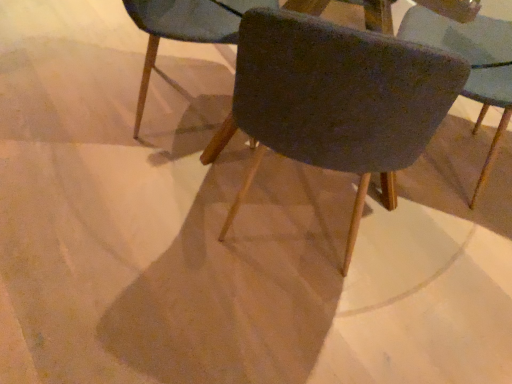
The image size is (512, 384). What do you see at coordinates (337, 99) in the screenshot?
I see `velvet dark blue chair at center, placed as the 2th chair when sorted from left to right` at bounding box center [337, 99].

Measure the distance between velvet dark blue chair at center, the 3th chair from the right, and camera.

4.02 feet.

Identify the location of velvet dark blue chair at center, the 1th chair in the left-to-right sequence. This screenshot has height=384, width=512. (185, 28).

Locate an element on the screen. The width and height of the screenshot is (512, 384). velvet dark blue chair at center, the second chair when ordered from right to left is located at coordinates (337, 99).

Choose the correct answer: Is velvet dark blue chair at center, which is the 1th chair from right to left, inside velvet dark blue chair at center, placed as the 2th chair when sorted from left to right, or outside it?

velvet dark blue chair at center, which is the 1th chair from right to left, lies outside velvet dark blue chair at center, placed as the 2th chair when sorted from left to right.

Could you measure the distance between velvet dark blue chair at center, the 3th chair viewed from the left, and velvet dark blue chair at center, the second chair when ordered from right to left?

velvet dark blue chair at center, the 3th chair viewed from the left, and velvet dark blue chair at center, the second chair when ordered from right to left, are 27.12 inches apart from each other.

Find the location of `the 1st chair behind the velvet dark blue chair at center, placed as the 2th chair when sorted from left to right`. the 1st chair behind the velvet dark blue chair at center, placed as the 2th chair when sorted from left to right is located at coordinates (472, 64).

Is the position of velvet dark blue chair at center, the 3th chair from the right, more distant than that of velvet dark blue chair at center, the 3th chair viewed from the left?

Yes, velvet dark blue chair at center, the 3th chair from the right, is further from the camera.

How different are the orientations of velvet dark blue chair at center, the 1th chair in the left-to-right sequence, and velvet dark blue chair at center, the 3th chair viewed from the left, in degrees?

161 degrees.

Would you say velvet dark blue chair at center, which is the 1th chair from right to left, is part of velvet dark blue chair at center, the 3th chair from the right,'s contents?

No, velvet dark blue chair at center, which is the 1th chair from right to left, is not inside velvet dark blue chair at center, the 3th chair from the right.

Does velvet dark blue chair at center, the 3th chair from the right, turn towards velvet dark blue chair at center, the 3th chair viewed from the left?

Yes.

Can you see velvet dark blue chair at center, which is the 1th chair from right to left, touching velvet dark blue chair at center, the 3th chair from the right?

There is a gap between velvet dark blue chair at center, which is the 1th chair from right to left, and velvet dark blue chair at center, the 3th chair from the right.

Locate an element on the screen. chair that is the 1st one above the velvet dark blue chair at center, the 3th chair from the right (from a real-world perspective) is located at coordinates click(472, 64).

In terms of size, does velvet dark blue chair at center, the 3th chair viewed from the left, appear bigger or smaller than velvet dark blue chair at center, the 3th chair from the right?

Clearly, velvet dark blue chair at center, the 3th chair viewed from the left, is larger in size than velvet dark blue chair at center, the 3th chair from the right.

Between point (490, 40) and point (268, 4), which one is positioned behind?

The point (490, 40) is behind.

Considering the sizes of objects velvet dark blue chair at center, the second chair when ordered from right to left, and velvet dark blue chair at center, which is the 1th chair from right to left, in the image provided, who is wider, velvet dark blue chair at center, the second chair when ordered from right to left, or velvet dark blue chair at center, which is the 1th chair from right to left,?

velvet dark blue chair at center, the second chair when ordered from right to left.

Measure the distance between velvet dark blue chair at center, the second chair when ordered from right to left, and velvet dark blue chair at center, which is the 1th chair from right to left.

The distance of velvet dark blue chair at center, the second chair when ordered from right to left, from velvet dark blue chair at center, which is the 1th chair from right to left, is 27.12 inches.

Which is more to the right, velvet dark blue chair at center, the second chair when ordered from right to left, or velvet dark blue chair at center, which is the 1th chair from right to left?

velvet dark blue chair at center, which is the 1th chair from right to left.

From the image's perspective, does velvet dark blue chair at center, the second chair when ordered from right to left, appear lower than velvet dark blue chair at center, which is the 1th chair from right to left?

Correct, velvet dark blue chair at center, the second chair when ordered from right to left, appears lower than velvet dark blue chair at center, which is the 1th chair from right to left, in the image.

Based on the photo, does velvet dark blue chair at center, the 3th chair from the right, touch velvet dark blue chair at center, placed as the 2th chair when sorted from left to right?

No, velvet dark blue chair at center, the 3th chair from the right, is not beside velvet dark blue chair at center, placed as the 2th chair when sorted from left to right.

Is velvet dark blue chair at center, the 1th chair in the left-to-right sequence, to the left or to the right of velvet dark blue chair at center, placed as the 2th chair when sorted from left to right, in the image?

velvet dark blue chair at center, the 1th chair in the left-to-right sequence, is positioned on velvet dark blue chair at center, placed as the 2th chair when sorted from left to right,'s left side.

Is velvet dark blue chair at center, the 1th chair in the left-to-right sequence, spatially inside velvet dark blue chair at center, the second chair when ordered from right to left, or outside of it?

The correct answer is: outside.

What's the angular difference between velvet dark blue chair at center, the 3th chair from the right, and velvet dark blue chair at center, the second chair when ordered from right to left,'s facing directions?

The angle between the facing direction of velvet dark blue chair at center, the 3th chair from the right, and the facing direction of velvet dark blue chair at center, the second chair when ordered from right to left, is 73 degrees.

From the image's perspective, does velvet dark blue chair at center, placed as the 2th chair when sorted from left to right, appear higher than velvet dark blue chair at center, the 1th chair in the left-to-right sequence?

No, from the image's perspective, velvet dark blue chair at center, placed as the 2th chair when sorted from left to right, is not on top of velvet dark blue chair at center, the 1th chair in the left-to-right sequence.

Is point (328, 85) closer or farther from the camera than point (149, 35)?

Point (328, 85) is positioned closer to the camera compared to point (149, 35).

Is velvet dark blue chair at center, placed as the 2th chair when sorted from left to right, positioned with its back to velvet dark blue chair at center, the 3th chair from the right?

velvet dark blue chair at center, placed as the 2th chair when sorted from left to right, is not turned away from velvet dark blue chair at center, the 3th chair from the right.

From a real-world perspective, who is located lower, velvet dark blue chair at center, the second chair when ordered from right to left, or velvet dark blue chair at center, the 1th chair in the left-to-right sequence?

velvet dark blue chair at center, the 1th chair in the left-to-right sequence.

Find the location of a particular element. Image resolution: width=512 pixels, height=384 pixels. chair that is above the velvet dark blue chair at center, the 3th chair viewed from the left (from a real-world perspective) is located at coordinates (337, 99).

Identify the location of the 2nd chair counting from the left side of the velvet dark blue chair at center, the 3th chair viewed from the left. The image size is (512, 384). (185, 28).

Looking at the image, which one is located further to velvet dark blue chair at center, the 3th chair viewed from the left, velvet dark blue chair at center, the 3th chair from the right, or velvet dark blue chair at center, placed as the 2th chair when sorted from left to right?

Based on the image, velvet dark blue chair at center, placed as the 2th chair when sorted from left to right, appears to be further to velvet dark blue chair at center, the 3th chair viewed from the left.

Based on their spatial positions, is velvet dark blue chair at center, the 3th chair viewed from the left, or velvet dark blue chair at center, the 1th chair in the left-to-right sequence, further from velvet dark blue chair at center, the second chair when ordered from right to left?

velvet dark blue chair at center, the 3th chair viewed from the left, lies further to velvet dark blue chair at center, the second chair when ordered from right to left, than the other object.

From the image, which object appears to be nearer to velvet dark blue chair at center, which is the 1th chair from right to left, velvet dark blue chair at center, placed as the 2th chair when sorted from left to right, or velvet dark blue chair at center, the 1th chair in the left-to-right sequence?

Among the two, velvet dark blue chair at center, the 1th chair in the left-to-right sequence, is located nearer to velvet dark blue chair at center, which is the 1th chair from right to left.

Based on their spatial positions, is velvet dark blue chair at center, the 3th chair from the right, or velvet dark blue chair at center, which is the 1th chair from right to left, further from velvet dark blue chair at center, the second chair when ordered from right to left?

velvet dark blue chair at center, which is the 1th chair from right to left, lies further to velvet dark blue chair at center, the second chair when ordered from right to left, than the other object.

When comparing their distances from velvet dark blue chair at center, the 1th chair in the left-to-right sequence, does velvet dark blue chair at center, which is the 1th chair from right to left, or velvet dark blue chair at center, the second chair when ordered from right to left, seem closer?

velvet dark blue chair at center, which is the 1th chair from right to left, is closer to velvet dark blue chair at center, the 1th chair in the left-to-right sequence.

Looking at the image, which one is located closer to velvet dark blue chair at center, the 1th chair in the left-to-right sequence, velvet dark blue chair at center, placed as the 2th chair when sorted from left to right, or velvet dark blue chair at center, the 3th chair viewed from the left?

The object closer to velvet dark blue chair at center, the 1th chair in the left-to-right sequence, is velvet dark blue chair at center, the 3th chair viewed from the left.

The image size is (512, 384). What are the coordinates of `chair between velvet dark blue chair at center, the 1th chair in the left-to-right sequence, and velvet dark blue chair at center, which is the 1th chair from right to left, in the horizontal direction` in the screenshot? It's located at (337, 99).